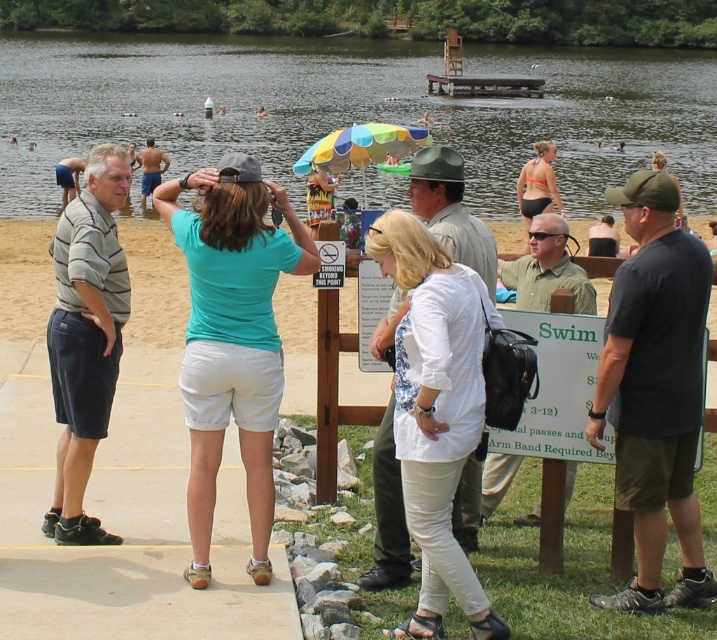
You are standing at point (87, 529) and want to walk to the wooden signpost. Is there a clear path to the signpost without going through point (526, 148)?

Point (526, 148) is behind point (87, 529), so walking towards the wooden signpost from point (87, 529) would not require passing through point (526, 148). The path should be clear.

You are a photographer standing at the lakeside and want to take a photo of the clear water at center and the striped polo shirt at center. Which object should you focus on first to ensure both are in sharp focus?

You should focus on the striped polo shirt at center first because it is closer to you than the clear water at center, which is further away. By focusing on the closer object, the background object will still be in acceptable focus due to depth of field.

You are a photographer trying to capture a clear shot of the striped polo shirt at center and the matte blue shorts at center. Which piece of clothing will appear larger in your photo?

The striped polo shirt at center will appear larger in the photo because it is closer to the viewer than the matte blue shorts at center.